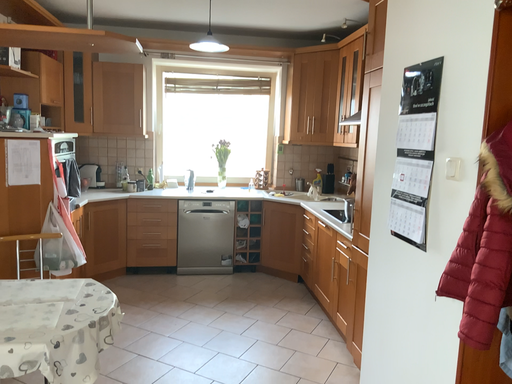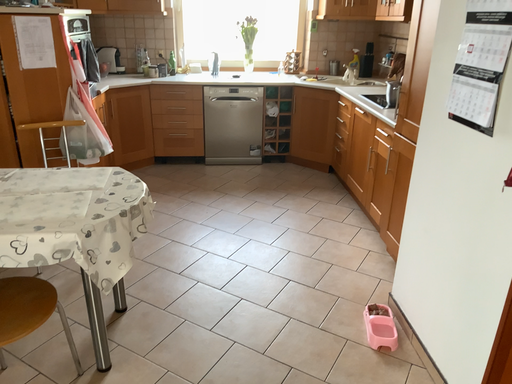
Question: How did the camera likely rotate when shooting the video?

Choices:
 (A) rotated downward
 (B) rotated upward

Answer: (A)